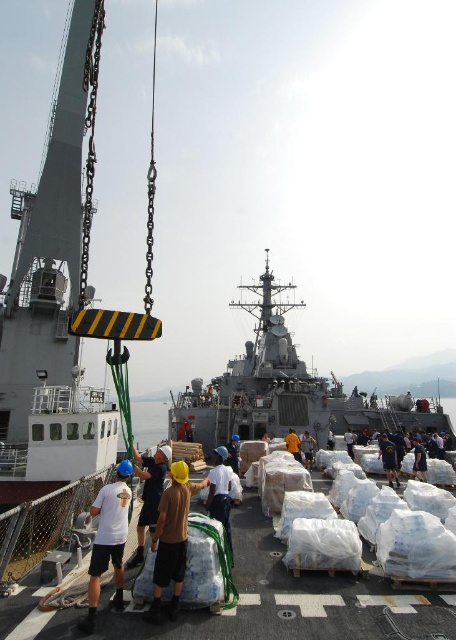
You are a crane operator on the naval ship deck. You need to move a heavy crate from point A to point B. The coordinates for point A are point A at (125, 529) and point B are point B at (214, 452). Considering the deck layout, which point is closer to the edge of the ship so you can safely lower the crate without hitting any obstacles?

Point A at (125, 529) is in front of point B at (214, 452), meaning it is closer to the edge of the ship. Therefore, lowering the crate at point A would be safer as it is less obstructed.

You are navigating a small drone that needs to fly from point A to point B on the naval ship deck. The drone has a limited battery and can only move forward in a straight line. If point A is point (x=181, y=481) and point B is point (x=81, y=620), which point should you start from to ensure the drone reaches the destination without running out of battery?

You should start from point (x=81, y=620) because it is closer to the destination point (x=181, y=481) than the other way around, so starting from the closer point ensures the drone can reach the destination with less distance traveled.

You are a photographer on the naval ship deck. You need to capture a photo of both the brown fabric shirt at center and the white matte shirt at center. Which shirt should you zoom in on to ensure both shirts are clearly visible in the photo?

The brown fabric shirt at center has a smaller width than the white matte shirt at center. To ensure both are clearly visible, you should zoom out slightly so that the wider white matte shirt at center fits within the frame, allowing the smaller brown fabric shirt at center to also be captured clearly.